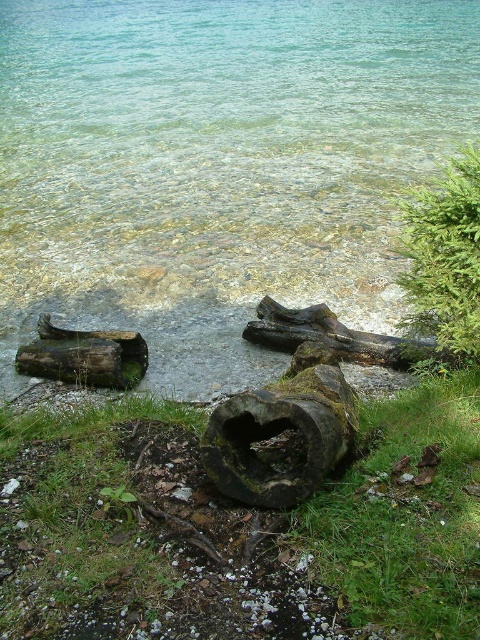
You are standing at the lakeside and want to take a photo of the green textured tree at upper right and the dark brown wood log at lower left. Which object should you focus on first if you want to capture both in a single frame without moving the camera?

The green textured tree at upper right is above the dark brown wood log at lower left, so you should focus on the green textured tree at upper right first to ensure both are in the frame.

You are standing at the lakeside and want to take a photo of the green textured tree at upper right. If your camera can focus on objects up to 3 meters away, will you need to move closer or farther away to capture it clearly?

The green textured tree at upper right is 3.40 meters from the camera, which is beyond the camera focus range of 3 meters. You need to move closer to the tree to ensure it is within the camera focus range.

You are standing at the edge of the lake and see the point labeled as point (217,164). What is located at that point?

The point (217,164) corresponds to clear water at center.